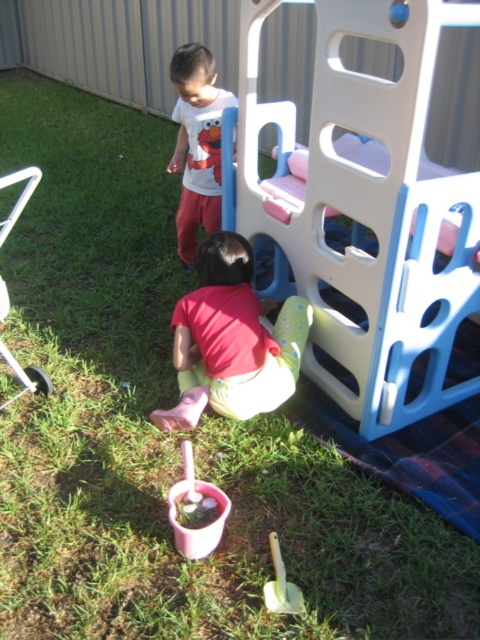
You are a parent supervising the children in the backyard. You notice the pink plastic cup at lower center and the yellow plastic shovel at lower center. Which object is bigger?

The pink plastic cup at lower center is larger in size compared to the yellow plastic shovel at lower center.

You are a parent trying to decide which item to pick up first. The pink rubber boots at lower center and the white matte shirt at upper center are both on the ground. Which item has a wider base and might be harder to move?

The pink rubber boots at lower center has a larger width than the white matte shirt at upper center, so it might be harder to move due to its wider base.